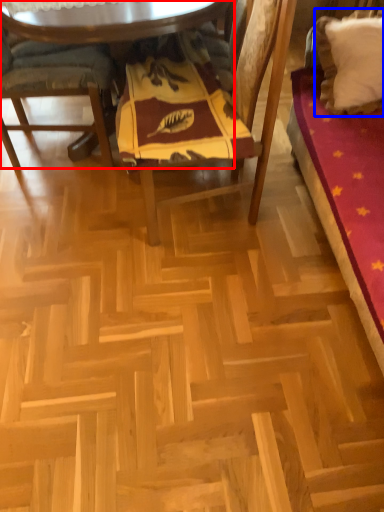
Question: Which object appears closest to the camera in this image, table (highlighted by a red box) or pillow (highlighted by a blue box)?

Choices:
 (A) table
 (B) pillow

Answer: (A)